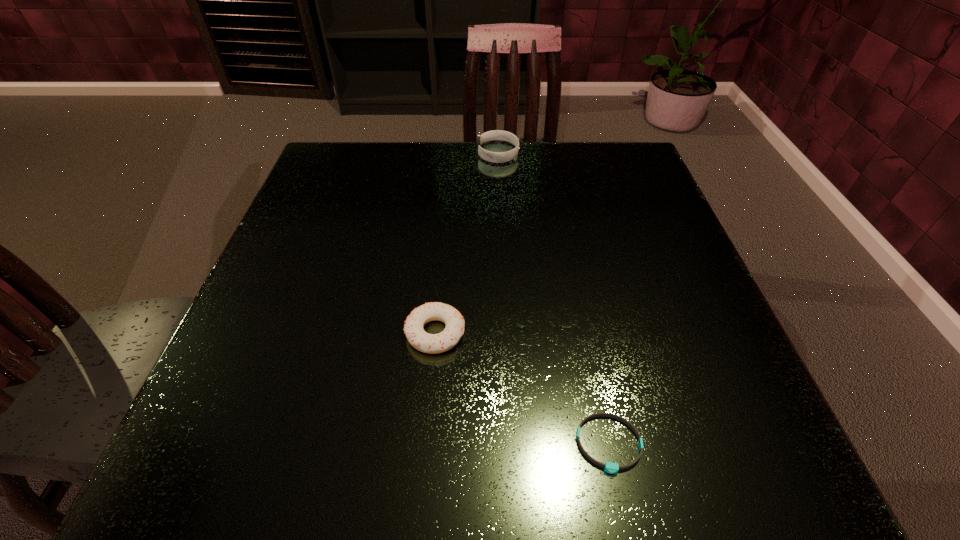
Find the location of a particular element. Image resolution: width=960 pixels, height=540 pixels. the left wristband is located at coordinates (497, 157).

Locate an element on the screen. the second object from right to left is located at coordinates (497, 157).

The width and height of the screenshot is (960, 540). I want to click on the leftmost object, so click(428, 343).

In order to click on doughnut in this screenshot , I will do `click(428, 343)`.

Image resolution: width=960 pixels, height=540 pixels. Identify the location of the right wristband. (609, 467).

Locate an element on the screen. The width and height of the screenshot is (960, 540). the nearest object is located at coordinates (609, 467).

Locate an element on the screen. vacant position located on the outer surface of the farthest object is located at coordinates (396, 153).

At what (x,y) coordinates should I click in order to perform the action: click on free space located on the outer surface of the farthest object. Please return your answer as a coordinate pair (x, y). The height and width of the screenshot is (540, 960). Looking at the image, I should click on (351, 153).

This screenshot has height=540, width=960. I want to click on free region located 0.300m on the outer surface of the farthest object, so click(356, 153).

This screenshot has width=960, height=540. What are the coordinates of `free region located 0.120m on the back of the second nearest object` in the screenshot? It's located at (442, 260).